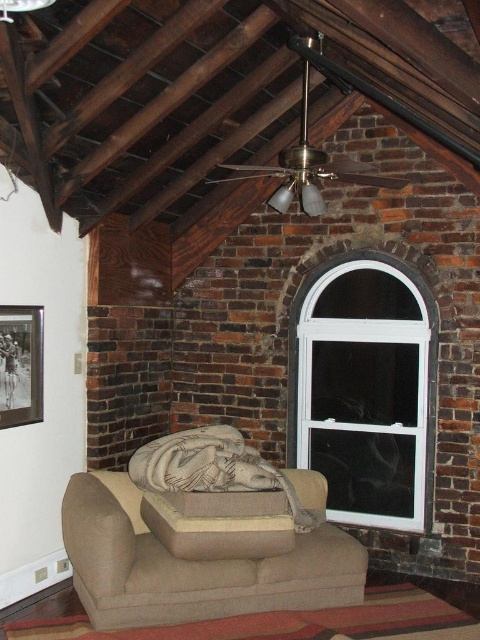
You are sitting on a chair that is 10 feet away from the beige fabric couch at center. Can you reach the couch without moving from your chair?

The beige fabric couch at center is 9.90 feet from viewer. Since you are sitting 10 feet away, you cannot reach it without moving closer.

You are sitting on the beige fabric couch at center and want to look out the white plastic window at upper right. Can you see the window clearly from your current position?

The beige fabric couch at center is closer to the viewer than the white plastic window at upper right, so yes, you can see the window clearly from your current position because it is further away and not obstructed by the couch.

You are trying to move a beige fabric couch at center through a doorway that leads to another room. The doorway has the same width as the white plastic window at upper right. Can the couch fit through the doorway?

The beige fabric couch at center might be wider than the white plastic window at upper right, so there is a possibility that the couch would not fit through the doorway.